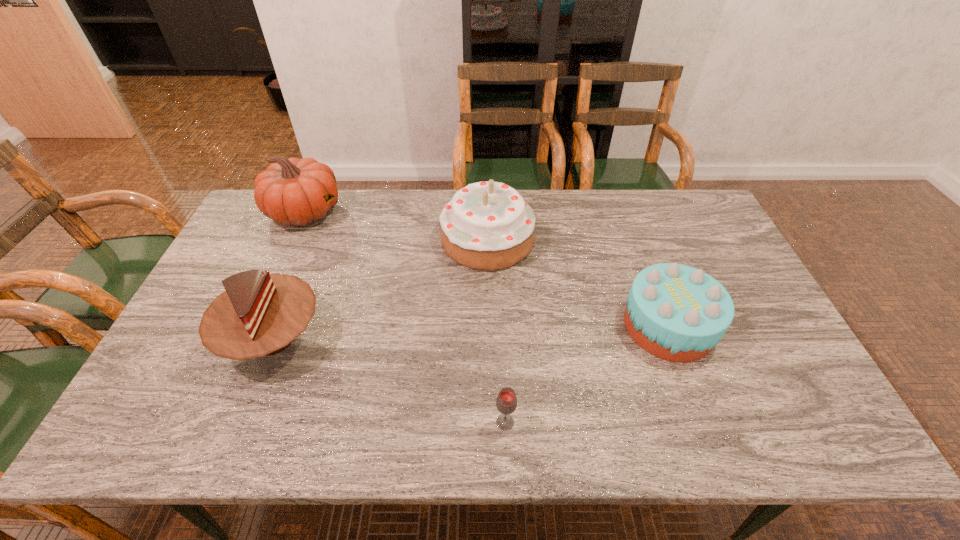
What are the coordinates of `pumpkin` in the screenshot? It's located at (293, 191).

Where is `the farthest cake`? the farthest cake is located at coordinates (487, 225).

This screenshot has height=540, width=960. In order to click on the leftmost cake in this screenshot , I will do `click(260, 314)`.

Identify the location of the rightmost cake. (675, 312).

Where is `the nearest object`? This screenshot has width=960, height=540. the nearest object is located at coordinates (506, 402).

The image size is (960, 540). I want to click on the shortest object, so click(506, 402).

What are the coordinates of `vacant space situated on the face of the pumpkin` in the screenshot? It's located at (456, 212).

Where is `vacant space located on the right of the farthest cake`? vacant space located on the right of the farthest cake is located at coordinates (593, 239).

This screenshot has width=960, height=540. I want to click on vacant space situated 0.320m on the back of the leftmost cake, so click(x=318, y=227).

The image size is (960, 540). What are the coordinates of `free space located 0.180m on the back of the rightmost object` in the screenshot? It's located at (640, 249).